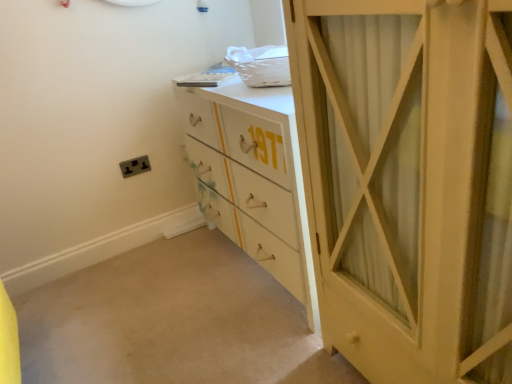
Question: Is white painted wood chest of drawers at center in front of or behind matte white cabinet at right in the image?

Choices:
 (A) behind
 (B) front

Answer: (A)

Question: Choose the correct answer: Is white painted wood chest of drawers at center inside matte white cabinet at right or outside it?

Choices:
 (A) inside
 (B) outside

Answer: (B)

Question: Which of these objects is positioned farthest from the matte white cabinet at right?

Choices:
 (A) matte black socket at lower left
 (B) white painted wood chest of drawers at center

Answer: (A)

Question: Estimate the real-world distances between objects in this image. Which object is farther from the matte white cabinet at right?

Choices:
 (A) matte black socket at lower left
 (B) white painted wood chest of drawers at center

Answer: (A)